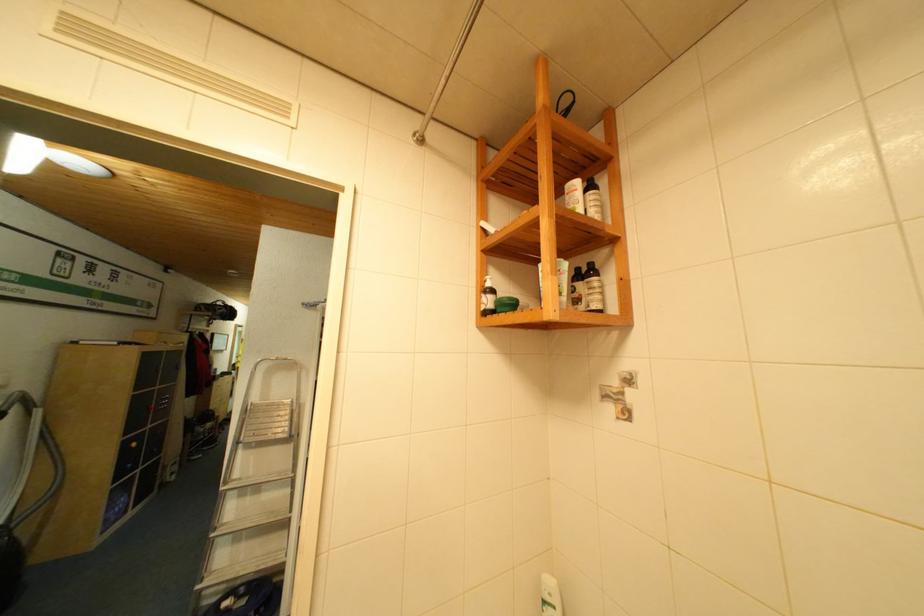
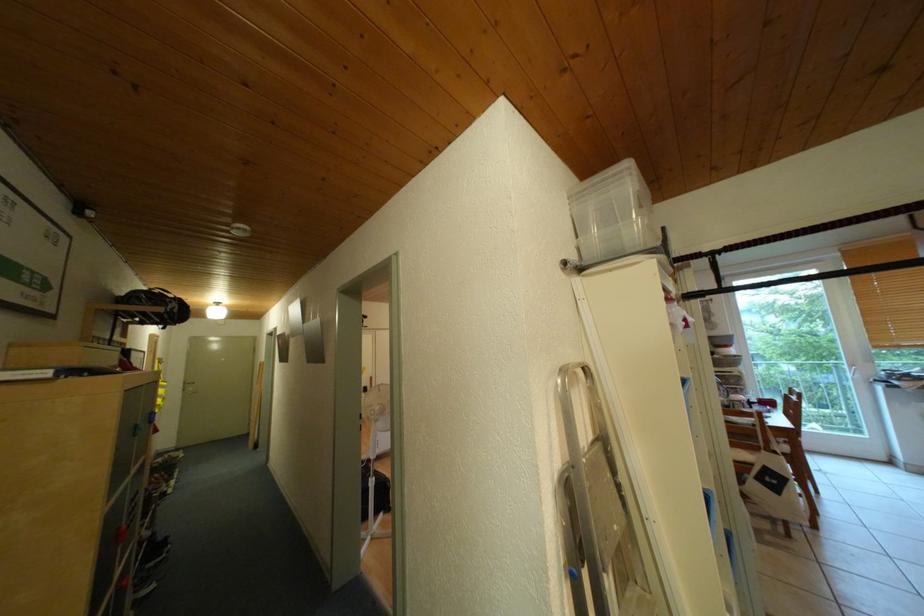
What movement of the cameraman would produce the second image?

The movement direction of the cameraman is left, forward.